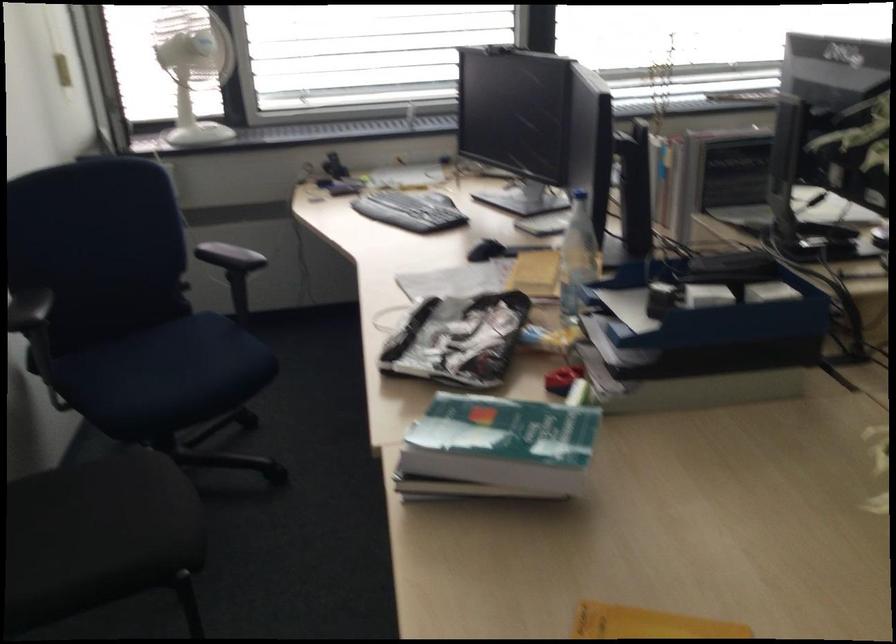
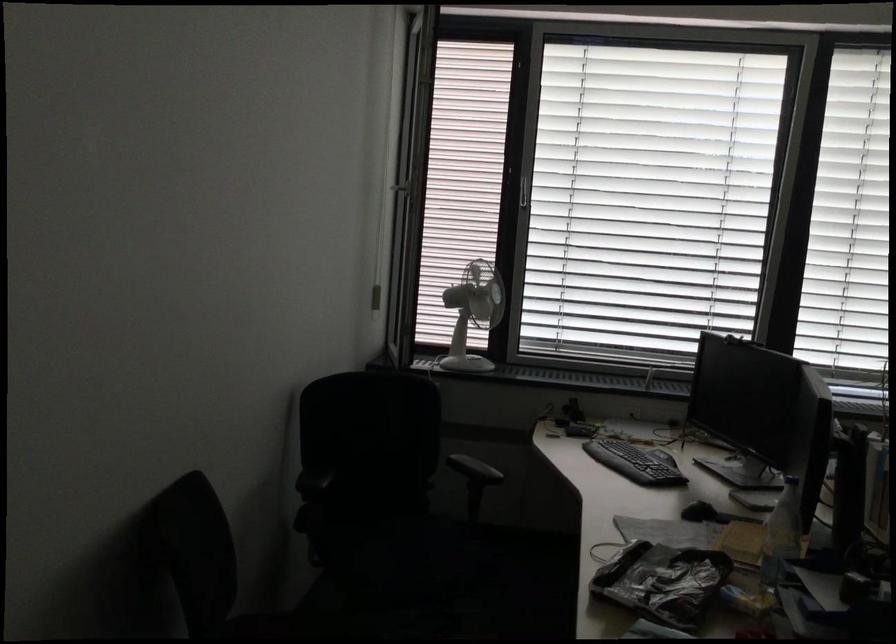
Question: The camera is either moving clockwise (left) or counter-clockwise (right) around the object. The first image is from the beginning of the video and the second image is from the end. Is the camera moving left or right when shooting the video?

Choices:
 (A) Left
 (B) Right

Answer: (B)